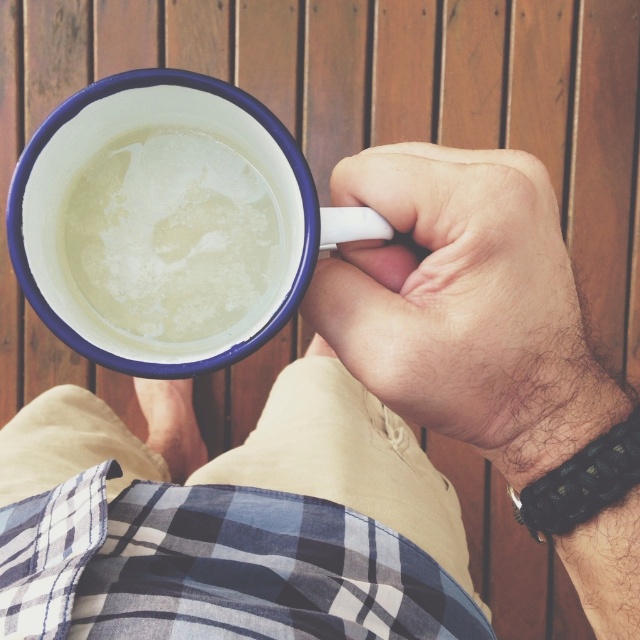
Question: Is white enamel mug at center to the left of matte white hand at center from the viewer's perspective?

Choices:
 (A) no
 (B) yes

Answer: (B)

Question: Which object appears closest to the camera in this image?

Choices:
 (A) matte white hand at center
 (B) white enamel mug at center

Answer: (B)

Question: Which object is closer to the camera taking this photo?

Choices:
 (A) matte white hand at center
 (B) white enamel mug at center

Answer: (B)

Question: Observing the image, what is the correct spatial positioning of white enamel mug at center in reference to matte white hand at center?

Choices:
 (A) below
 (B) above

Answer: (B)

Question: Can you confirm if white enamel mug at center is bigger than matte white hand at center?

Choices:
 (A) yes
 (B) no

Answer: (A)